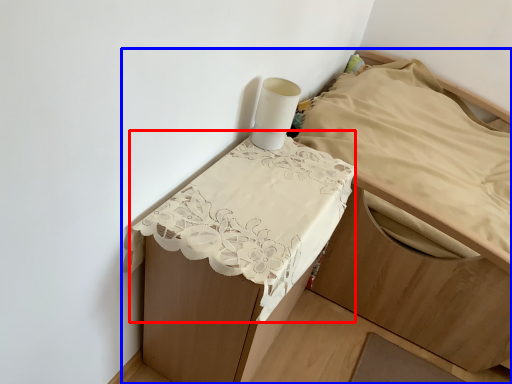
Question: Which object appears closest to the camera in this image, sheet (highlighted by a red box) or furniture (highlighted by a blue box)?

Choices:
 (A) sheet
 (B) furniture

Answer: (A)